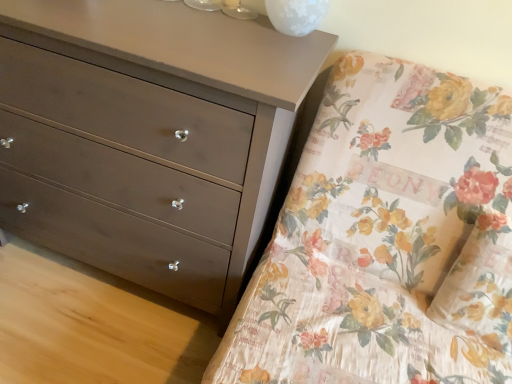
Question: Does floral fabric pillow at right come in front of matte brown dresser at left?

Choices:
 (A) yes
 (B) no

Answer: (B)

Question: Is matte brown dresser at left at the back of floral fabric pillow at right?

Choices:
 (A) yes
 (B) no

Answer: (B)

Question: Is floral fabric pillow at right next to matte brown dresser at left?

Choices:
 (A) no
 (B) yes

Answer: (A)

Question: Could you tell me if floral fabric pillow at right is facing matte brown dresser at left?

Choices:
 (A) no
 (B) yes

Answer: (A)

Question: Does floral fabric pillow at right have a smaller size compared to matte brown dresser at left?

Choices:
 (A) no
 (B) yes

Answer: (B)

Question: Considering the relative sizes of floral fabric pillow at right and matte brown dresser at left in the image provided, is floral fabric pillow at right wider than matte brown dresser at left?

Choices:
 (A) no
 (B) yes

Answer: (A)

Question: From the image's perspective, would you say floral fabric pillow at right is positioned over white frosted glass at upper center?

Choices:
 (A) yes
 (B) no

Answer: (B)

Question: Is floral fabric pillow at right surrounding white frosted glass at upper center?

Choices:
 (A) no
 (B) yes

Answer: (A)

Question: Can you confirm if floral fabric pillow at right is bigger than white frosted glass at upper center?

Choices:
 (A) no
 (B) yes

Answer: (B)

Question: From a real-world perspective, does floral fabric pillow at right sit lower than white frosted glass at upper center?

Choices:
 (A) no
 (B) yes

Answer: (B)

Question: Considering the relative positions of floral fabric pillow at right and white frosted glass at upper center in the image provided, is floral fabric pillow at right in front of white frosted glass at upper center?

Choices:
 (A) no
 (B) yes

Answer: (B)

Question: Is floral fabric pillow at right next to white frosted glass at upper center?

Choices:
 (A) no
 (B) yes

Answer: (A)

Question: Does floral fabric bed at upper right have a lesser width compared to matte brown dresser at left?

Choices:
 (A) yes
 (B) no

Answer: (B)